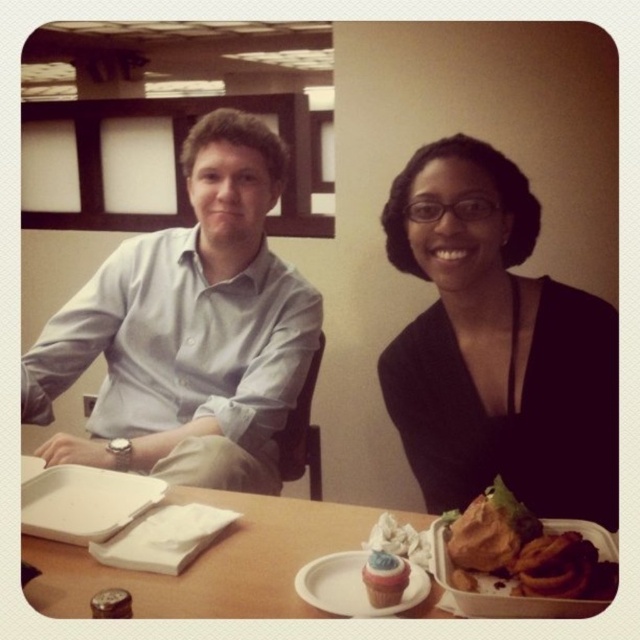
Who is lower down, matte white shirt at upper left or smooth white cupcake at lower center?

Positioned lower is smooth white cupcake at lower center.

The image size is (640, 640). Describe the element at coordinates (502, 356) in the screenshot. I see `matte white shirt at upper left` at that location.

Locate an element on the screen. The height and width of the screenshot is (640, 640). matte white shirt at upper left is located at coordinates (502, 356).

Which of these two, matte white shirt at upper left or wooden table at center, stands shorter?

Standing shorter between the two is wooden table at center.

Which is above, matte white shirt at upper left or wooden table at center?

matte white shirt at upper left is higher up.

This screenshot has width=640, height=640. Find the location of `matte white shirt at upper left`. matte white shirt at upper left is located at coordinates (502, 356).

Where is `matte white shirt at upper left`? matte white shirt at upper left is located at coordinates (502, 356).

How much distance is there between light blue shirt at center and black matte dress at center?

light blue shirt at center is 19.58 inches from black matte dress at center.

Between light blue shirt at center and black matte dress at center, which one appears on the left side from the viewer's perspective?

light blue shirt at center

Identify the location of light blue shirt at center. (192, 328).